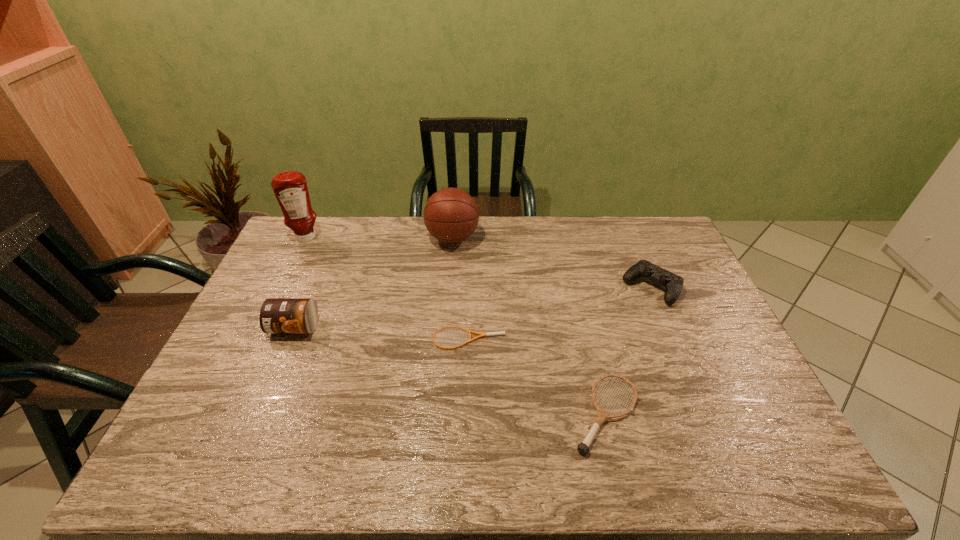
The height and width of the screenshot is (540, 960). I want to click on empty location between the second shortest object and the condiment, so (x=456, y=326).

I want to click on free space between the condiment and the nearest object, so click(456, 326).

Identify the location of free space between the second shortest object and the basketball. This screenshot has height=540, width=960. (529, 326).

Image resolution: width=960 pixels, height=540 pixels. Identify the location of free area in between the can and the basketball. (x=373, y=282).

Image resolution: width=960 pixels, height=540 pixels. I want to click on vacant space in between the nearest object and the can, so click(450, 370).

Locate an element on the screen. This screenshot has width=960, height=540. free spot between the taller tennis racket and the shorter tennis racket is located at coordinates (538, 376).

Identify the location of free space that is in between the third tallest object and the fifth tallest object. (450, 370).

Locate an element on the screen. The image size is (960, 540). unoccupied position between the second tallest object and the condiment is located at coordinates (380, 238).

Locate which object is the third closest to the fifth shortest object. Please provide its 2D coordinates. Your answer should be formatted as a tuple, i.e. [(x, y)], where the tuple contains the x and y coordinates of a point satisfying the conditions above.

[(277, 315)]

The height and width of the screenshot is (540, 960). I want to click on object that stands as the third closest to the condiment, so click(x=469, y=331).